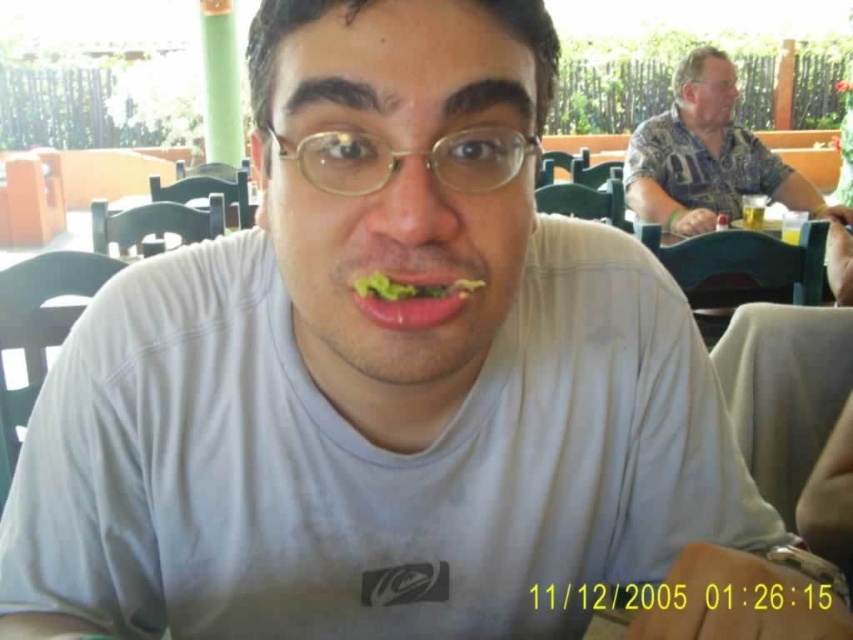
Question: Which point is farther from the camera taking this photo?

Choices:
 (A) (720, 170)
 (B) (310, 177)

Answer: (A)

Question: Which point appears farthest from the camera in this image?

Choices:
 (A) (360, 132)
 (B) (670, 232)
 (C) (474, 291)

Answer: (B)

Question: Is hawaiian shirt at upper right behind gold-framed glasses at center?

Choices:
 (A) no
 (B) yes

Answer: (B)

Question: Does hawaiian shirt at upper right appear on the right side of gold-framed glasses at center?

Choices:
 (A) yes
 (B) no

Answer: (A)

Question: Can you confirm if hawaiian shirt at upper right is thinner than gold-framed glasses at center?

Choices:
 (A) yes
 (B) no

Answer: (B)

Question: Estimate the real-world distances between objects in this image. Which object is farther from the green leafy lettuce at center?

Choices:
 (A) gold-framed glasses at center
 (B) hawaiian shirt at upper right

Answer: (B)